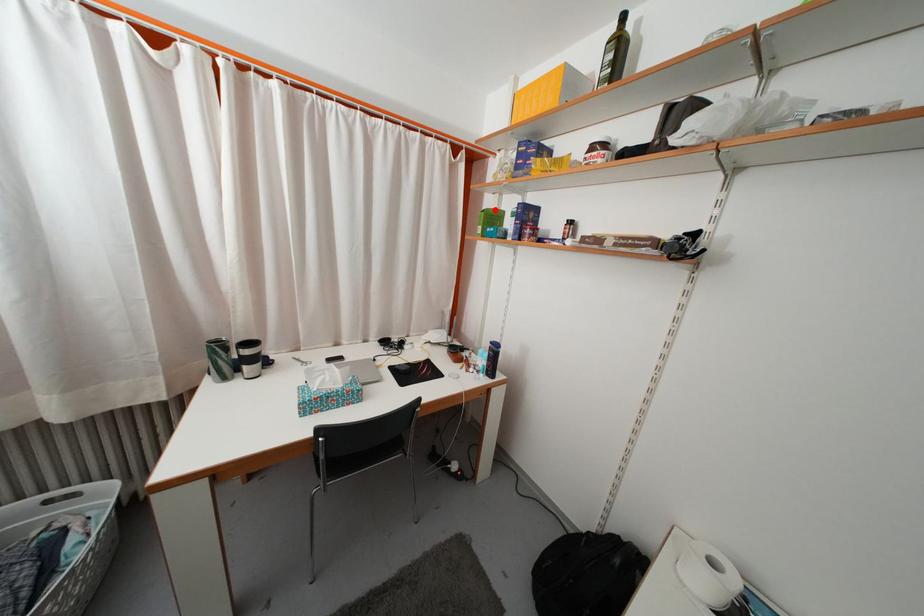
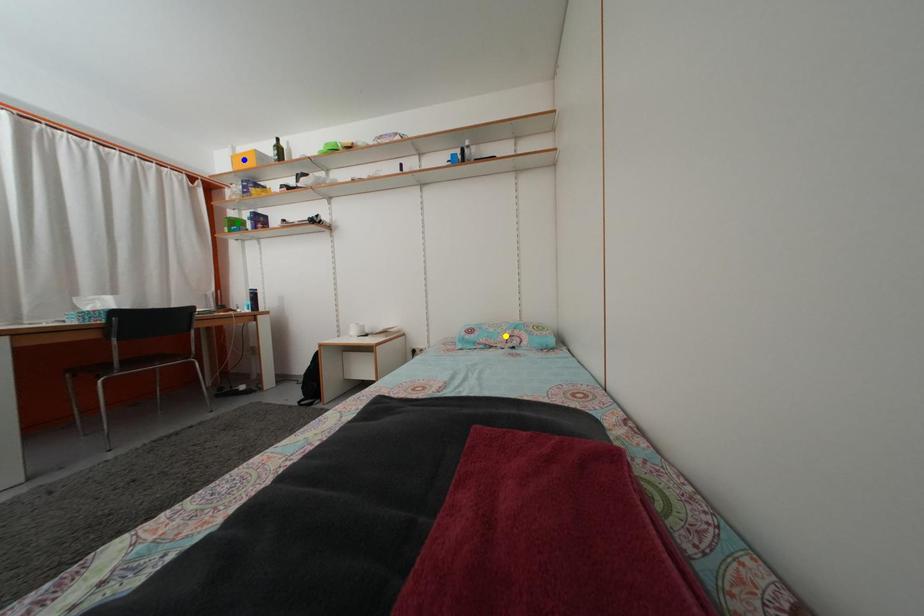
Question: I am providing you with two images of the same scene from different viewpoints. A red point is marked on the first image. You are given multiple points on the second image. Which spot in image 2 lines up with the point in image 1?

Choices:
 (A) yellow point
 (B) green point
 (C) blue point

Answer: (B)